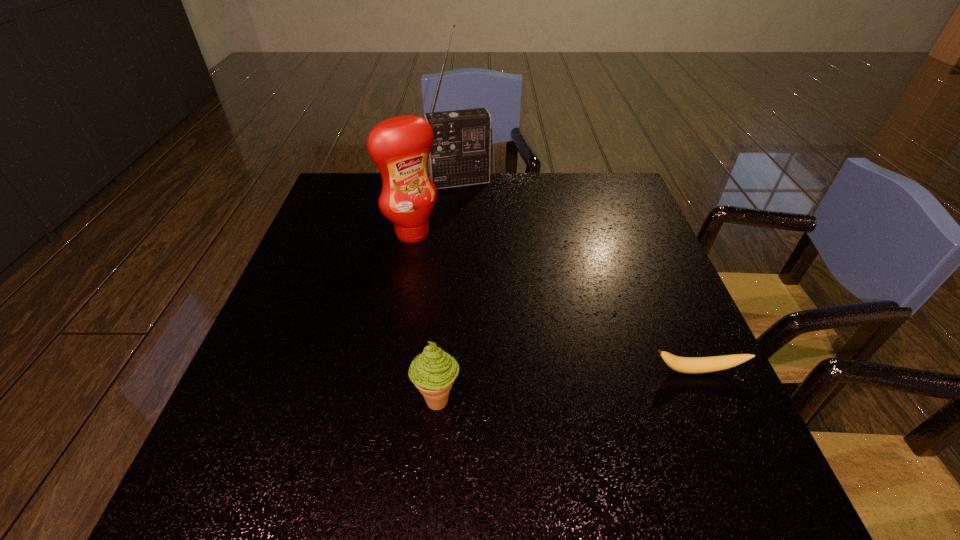
Identify the location of free space on the desktop that is between the third tallest object and the rightmost object and is positioned on the label side of the condiment. The height and width of the screenshot is (540, 960). (544, 388).

At what (x,y) coordinates should I click in order to perform the action: click on vacant space on the desktop that is between the icecream and the second nearest object and is positioned on the display of the farthest object. Please return your answer as a coordinate pair (x, y). Looking at the image, I should click on (540, 388).